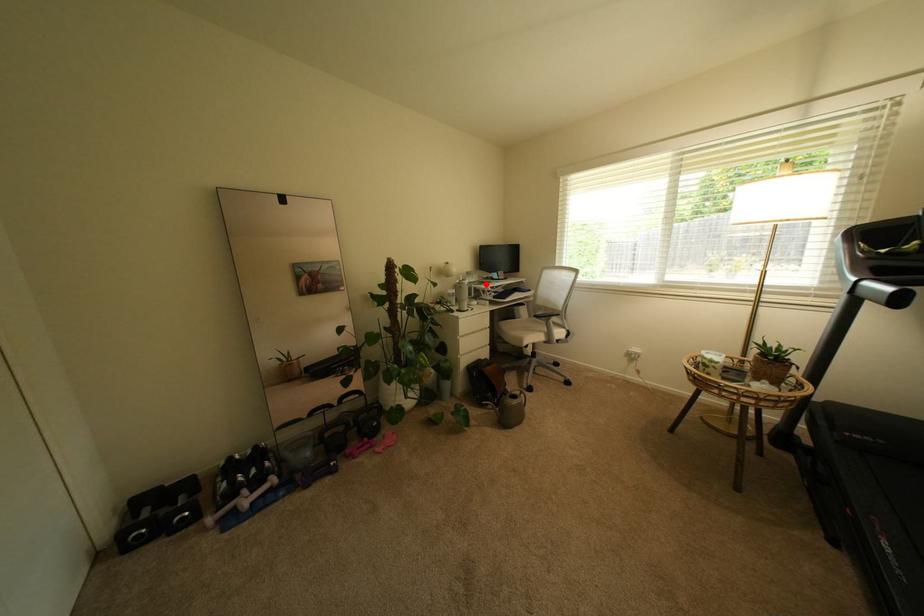
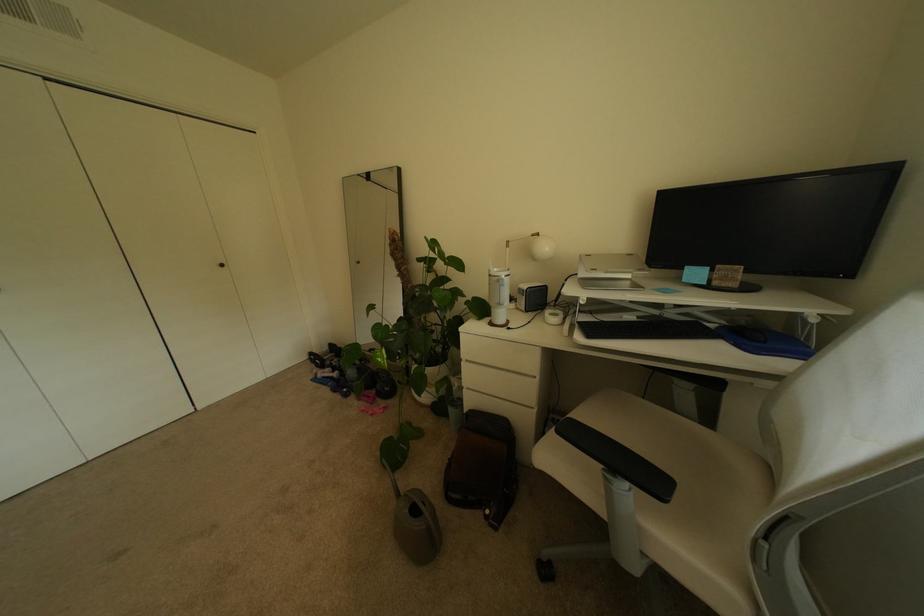
Where in the second image is the point corresponding to the highlighted location from the first image?

(637, 284)